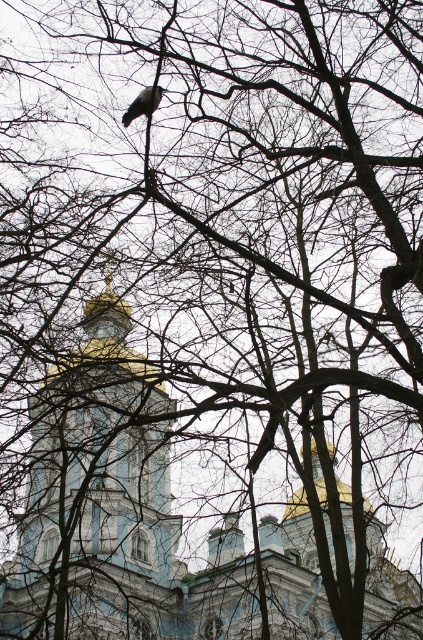
You are standing in front of the tree and want to take a photo of the two points marked in the image. Which point, point (101, 388) or point (123, 115), will appear closer to the camera in the photo?

Point (101, 388) is further to the camera than point (123, 115), so it will appear closer to the camera in the photo.

You are an architect analyzing the composition of this image. You notice the blue painted stone tower at center and the gray matte pigeon at upper center. Which object appears nearer to the observer in the scene?

The blue painted stone tower at center is closer to the viewer than the gray matte pigeon at upper center, so the tower appears nearer.